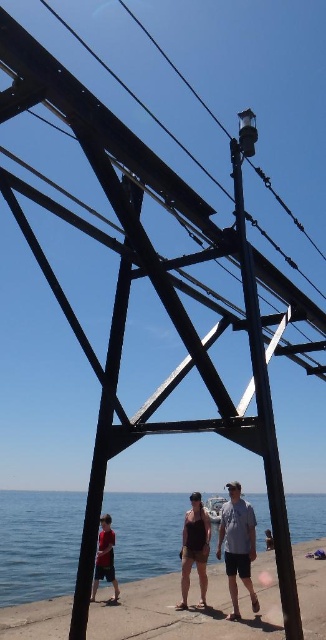
Does blue water at lower center have a lesser height compared to light blue denim shorts at center?

In fact, blue water at lower center may be taller than light blue denim shorts at center.

Who is more distant from viewer, (x=153, y=548) or (x=253, y=540)?

The point (x=153, y=548) is more distant.

Image resolution: width=326 pixels, height=640 pixels. I want to click on blue water at lower center, so click(x=39, y=544).

Can you confirm if black metal pole at center is positioned above light brown wooden boardwalk at lower center?

Correct, black metal pole at center is located above light brown wooden boardwalk at lower center.

Who is positioned more to the left, black metal pole at center or light brown wooden boardwalk at lower center?

Positioned to the left is black metal pole at center.

Between point (277, 508) and point (266, 544), which one is positioned in front?

Point (277, 508) is in front.

The height and width of the screenshot is (640, 326). I want to click on black metal pole at center, so click(x=266, y=416).

Is black metal pole at center thinner than dark brown tank top at center?

Indeed, black metal pole at center has a lesser width compared to dark brown tank top at center.

Is black metal pole at center behind dark brown tank top at center?

That is False.

What do you see at coordinates (266, 416) in the screenshot? The height and width of the screenshot is (640, 326). I see `black metal pole at center` at bounding box center [266, 416].

Find the location of a particular element. The image size is (326, 640). black metal pole at center is located at coordinates (266, 416).